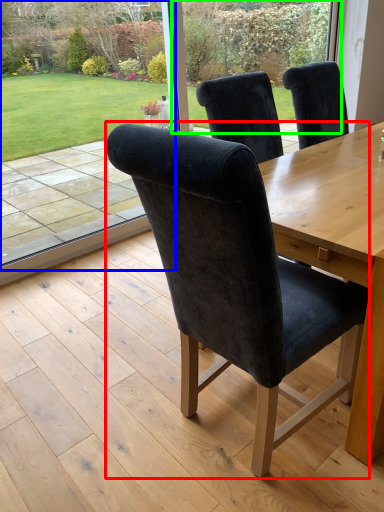
Question: Considering the real-world distances, which object is farthest from chair (highlighted by a red box)? window screen (highlighted by a blue box) or glass door (highlighted by a green box)?

Choices:
 (A) window screen
 (B) glass door

Answer: (B)